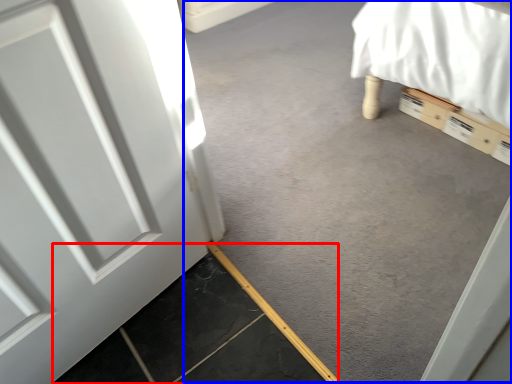
Question: Among these objects, which one is farthest to the camera, concrete (highlighted by a red box) or concrete (highlighted by a blue box)?

Choices:
 (A) concrete
 (B) concrete

Answer: (B)